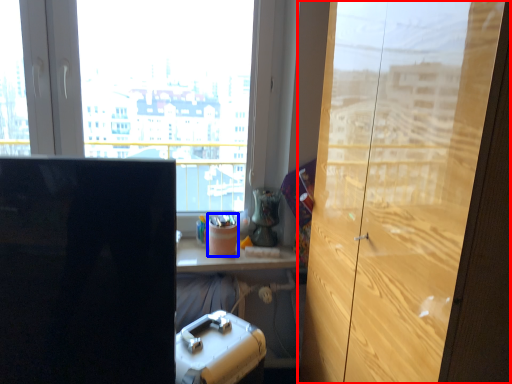
Question: Which of the following is the closest to the observer, cupboard (highlighted by a red box) or stationery (highlighted by a blue box)?

Choices:
 (A) cupboard
 (B) stationery

Answer: (A)